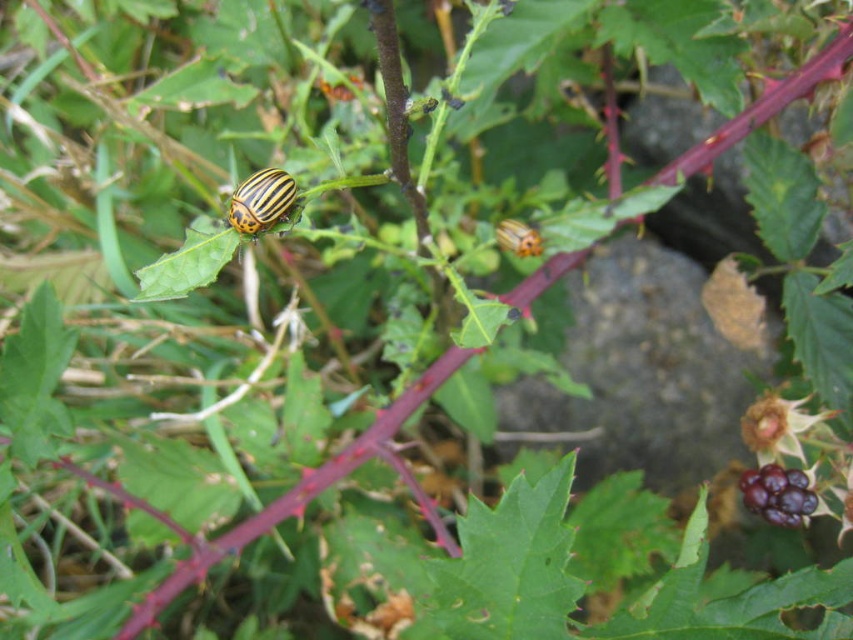
Between shiny purple berry at lower right and yellow-orange striped beetle at center, which one is positioned higher?

yellow-orange striped beetle at center

Can you confirm if shiny purple berry at lower right is positioned to the left of yellow-orange striped beetle at center?

Incorrect, shiny purple berry at lower right is not on the left side of yellow-orange striped beetle at center.

What do you see at coordinates (778, 493) in the screenshot? Image resolution: width=853 pixels, height=640 pixels. I see `shiny purple berry at lower right` at bounding box center [778, 493].

Identify the location of shiny purple berry at lower right. (778, 493).

Can you confirm if yellow-orange striped beetle at center is shorter than yellow striped beetle at center?

In fact, yellow-orange striped beetle at center may be taller than yellow striped beetle at center.

Can you confirm if yellow-orange striped beetle at center is positioned to the left of yellow striped beetle at center?

Yes, yellow-orange striped beetle at center is to the left of yellow striped beetle at center.

Locate an element on the screen. yellow-orange striped beetle at center is located at coordinates (262, 202).

Is the position of green matte leaf at center less distant than that of yellow-orange striped beetle at center?

That is True.

Does point (212, 248) lie in front of point (241, 188)?

Yes, point (212, 248) is closer to viewer.

Which is in front, point (181, 262) or point (277, 218)?

Point (181, 262)

You are a GUI agent. You are given a task and a screenshot of the screen. Output one action in this format:
    pyautogui.click(x=<x>, y=<y>)
    Task: Click on the green matte leaf at center
    
    Given the screenshot: What is the action you would take?
    pyautogui.click(x=187, y=264)